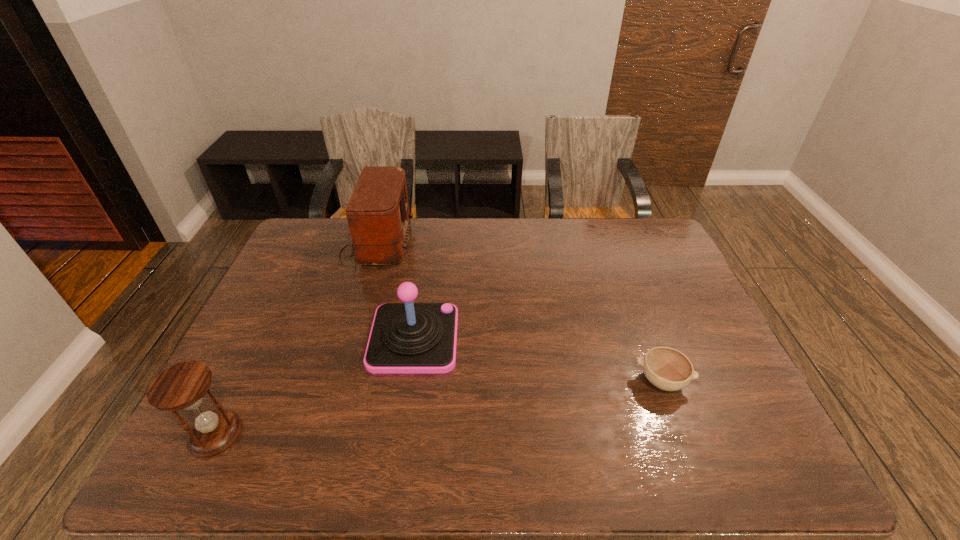
Where is `vacant space in between the shortest object and the radio receiver`? This screenshot has height=540, width=960. vacant space in between the shortest object and the radio receiver is located at coordinates (518, 312).

Locate an element on the screen. Image resolution: width=960 pixels, height=540 pixels. the third closest object relative to the leftmost object is located at coordinates (668, 369).

The image size is (960, 540). I want to click on the second closest object to the hourglass, so point(378,215).

I want to click on free space in the image that satisfies the following two spatial constraints: 1. on the front panel of the shortest object; 2. on the right side of the radio receiver, so coord(335,381).

Image resolution: width=960 pixels, height=540 pixels. I want to click on free space in the image that satisfies the following two spatial constraints: 1. on the back side of the shortest object; 2. forward from the base of the joystick, so click(646, 339).

Find the location of a particular element. This screenshot has height=540, width=960. vacant area that satisfies the following two spatial constraints: 1. forward from the base of the joystick; 2. on the back side of the shortest object is located at coordinates (408, 381).

I want to click on vacant space that satisfies the following two spatial constraints: 1. on the front panel of the radio receiver; 2. on the right side of the bowl, so click(335, 381).

In order to click on vacant space that satisfies the following two spatial constraints: 1. on the front panel of the radio receiver; 2. on the left side of the bowl in this screenshot , I will do `click(335, 381)`.